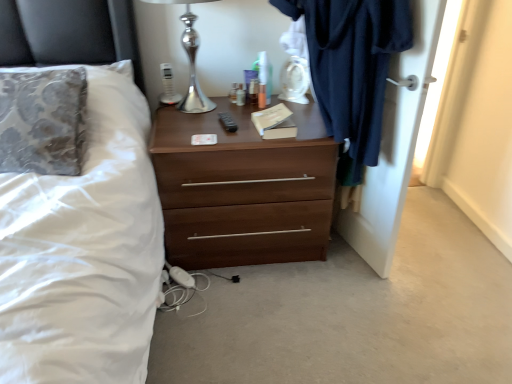
Question: From the image's perspective, would you say dark blue fabric at right is shown under white fabric bed at left?

Choices:
 (A) no
 (B) yes

Answer: (B)

Question: Considering the relative sizes of dark blue fabric at right and white fabric bed at left in the image provided, is dark blue fabric at right wider than white fabric bed at left?

Choices:
 (A) yes
 (B) no

Answer: (B)

Question: Can you see dark blue fabric at right touching white fabric bed at left?

Choices:
 (A) yes
 (B) no

Answer: (B)

Question: Considering the relative positions of dark blue fabric at right and white fabric bed at left in the image provided, is dark blue fabric at right to the left of white fabric bed at left from the viewer's perspective?

Choices:
 (A) no
 (B) yes

Answer: (A)

Question: Is dark blue fabric at right aimed at white fabric bed at left?

Choices:
 (A) no
 (B) yes

Answer: (A)

Question: Visually, is silver metallic table lamp at upper center positioned to the left or to the right of dark blue fabric at right?

Choices:
 (A) right
 (B) left

Answer: (B)

Question: From a real-world perspective, is silver metallic table lamp at upper center above or below dark blue fabric at right?

Choices:
 (A) below
 (B) above

Answer: (B)

Question: Considering their positions, is silver metallic table lamp at upper center located in front of or behind dark blue fabric at right?

Choices:
 (A) behind
 (B) front

Answer: (A)

Question: Looking at their shapes, would you say silver metallic table lamp at upper center is wider or thinner than dark blue fabric at right?

Choices:
 (A) wide
 (B) thin

Answer: (A)

Question: Is dark blue fabric at right inside the boundaries of dark blue fabric at right, or outside?

Choices:
 (A) inside
 (B) outside

Answer: (B)

Question: Is dark blue fabric at right in front of or behind dark blue fabric at right in the image?

Choices:
 (A) front
 (B) behind

Answer: (A)

Question: From a real-world perspective, relative to dark blue fabric at right, is dark blue fabric at right vertically above or below?

Choices:
 (A) above
 (B) below

Answer: (B)

Question: Does point (286, 4) appear closer or farther from the camera than point (354, 221)?

Choices:
 (A) closer
 (B) farther

Answer: (A)

Question: From their relative heights in the image, would you say silver metallic table lamp at upper center is taller or shorter than brown wood chest of drawers at center?

Choices:
 (A) tall
 (B) short

Answer: (B)

Question: Based on their sizes in the image, would you say silver metallic table lamp at upper center is bigger or smaller than brown wood chest of drawers at center?

Choices:
 (A) big
 (B) small

Answer: (B)